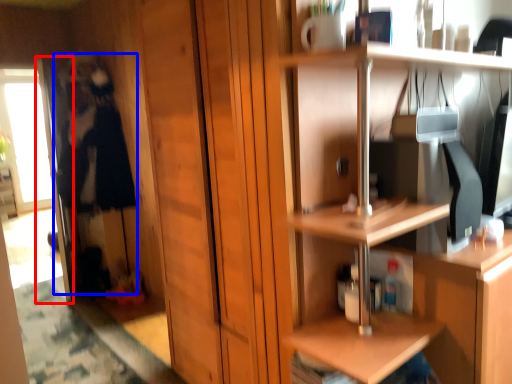
Question: Which point is closer to the camera, screen door (highlighted by a red box) or person (highlighted by a blue box)?

Choices:
 (A) screen door
 (B) person

Answer: (B)